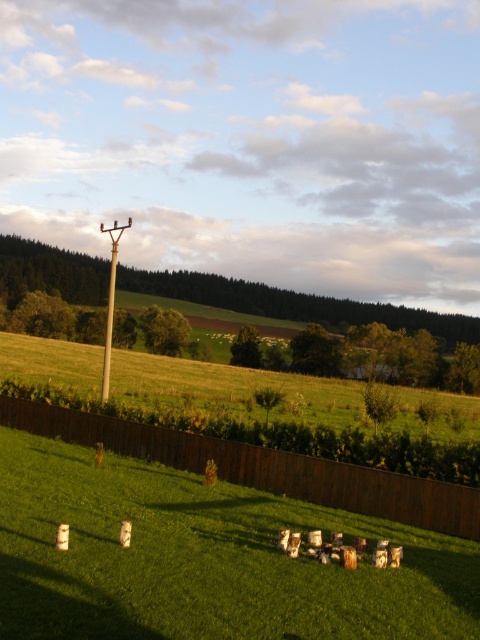
Question: Is brown wooden fence at lower center below smooth wooden pole at center?

Choices:
 (A) no
 (B) yes

Answer: (B)

Question: Does brown wooden fence at lower center come behind smooth wooden pole at center?

Choices:
 (A) yes
 (B) no

Answer: (B)

Question: Which point is closer to the camera taking this photo?

Choices:
 (A) (107, 444)
 (B) (109, 337)

Answer: (A)

Question: Which object is farther from the camera taking this photo?

Choices:
 (A) smooth wooden pole at center
 (B) brown wooden fence at lower center

Answer: (A)

Question: Is brown wooden fence at lower center smaller than smooth wooden pole at center?

Choices:
 (A) no
 (B) yes

Answer: (B)